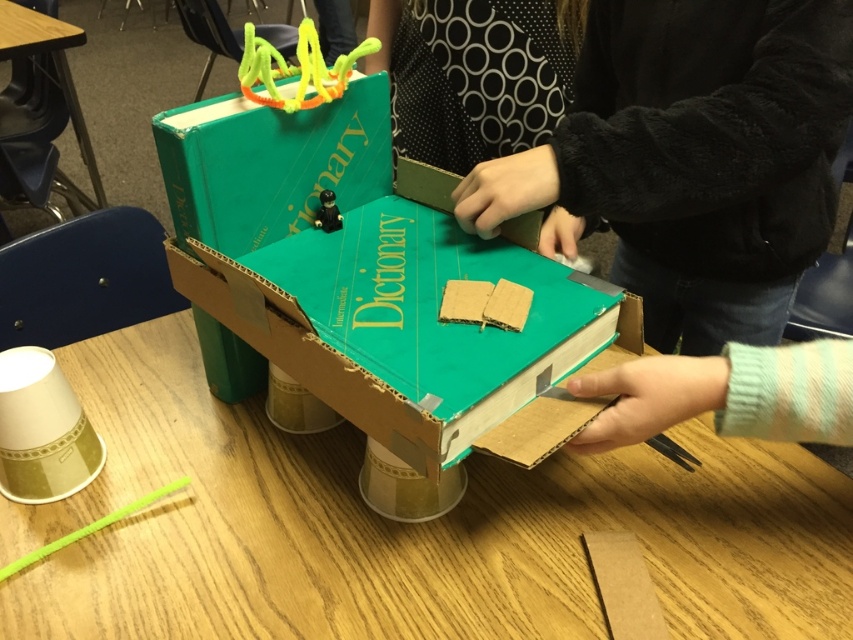
From the picture: You are a student who wants to place a new toy on top of the structure in the classroom. The structure has the cardboard at center and the green plastic toy at center. Where should you place the new toy to ensure it stays stable?

The cardboard at center is positioned under the green plastic toy at center, so placing the new toy on the cardboard at center would provide a stable base.